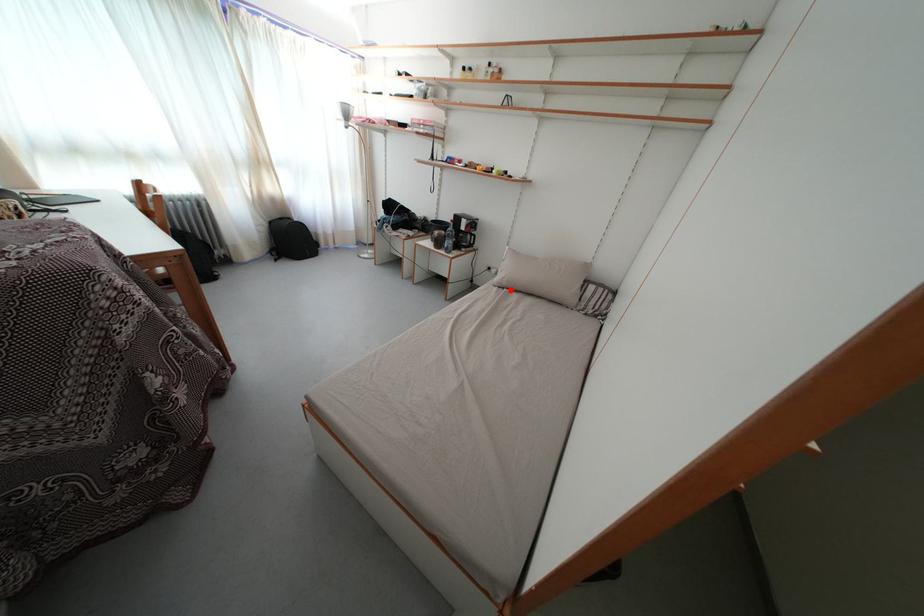
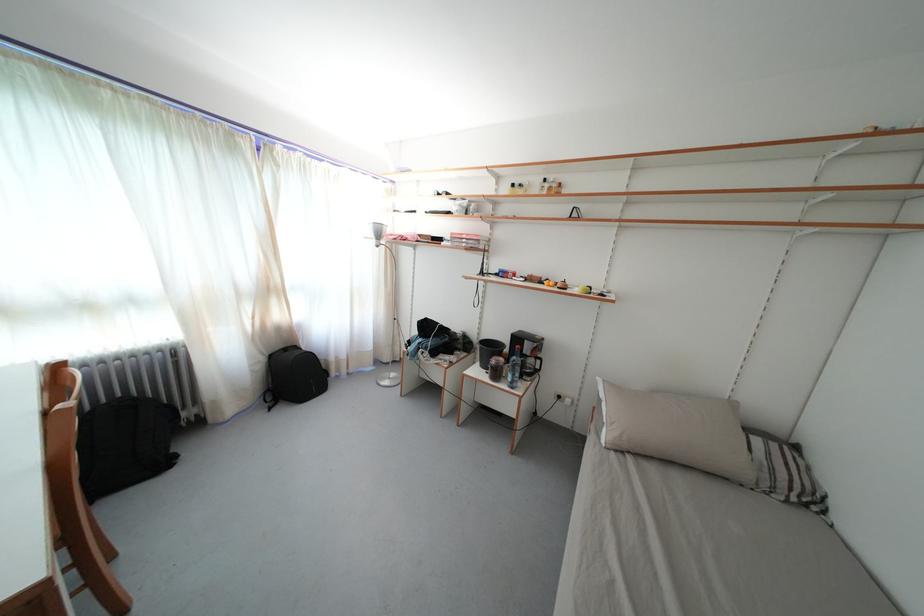
In the second image, find the point that corresponds to the highlighted location in the first image.

(630, 452)